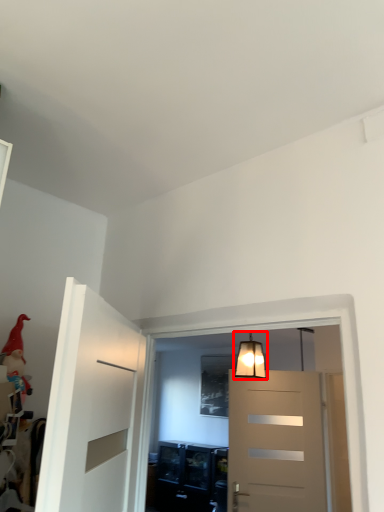
Question: From the image's perspective, where is lamp (annotated by the red box) located relative to toy?

Choices:
 (A) above
 (B) below

Answer: (B)